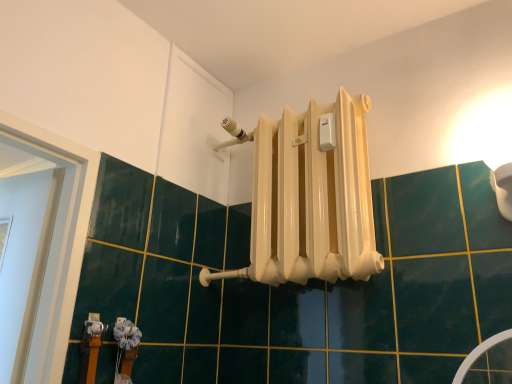
The image size is (512, 384). What are the coordinates of `white glossy radiator at center` in the screenshot? It's located at (311, 197).

The height and width of the screenshot is (384, 512). Describe the element at coordinates (311, 197) in the screenshot. I see `white glossy radiator at center` at that location.

I want to click on white glossy radiator at center, so [311, 197].